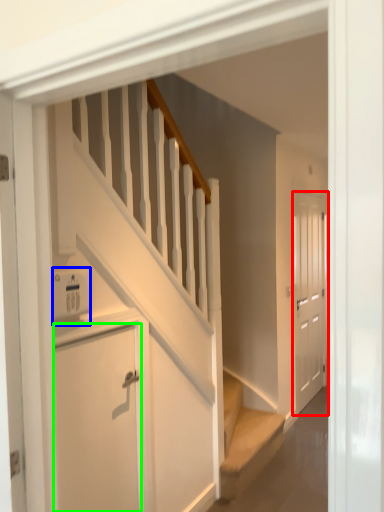
Question: Which object is positioned closest to door (highlighted by a red box)? Select from appliance (highlighted by a blue box) and door (highlighted by a green box).

Choices:
 (A) appliance
 (B) door

Answer: (B)